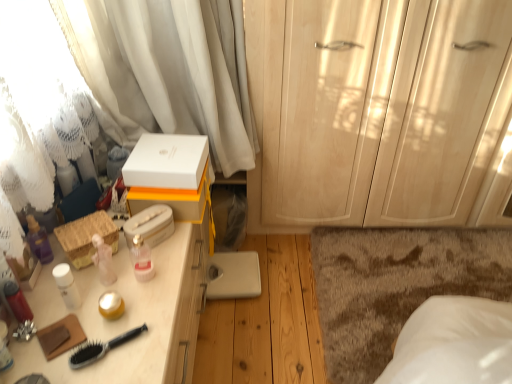
Where is `free spot behind matte white lotion at left, which is the first toiletry in bottom-to-top order`? The width and height of the screenshot is (512, 384). free spot behind matte white lotion at left, which is the first toiletry in bottom-to-top order is located at coordinates (46, 305).